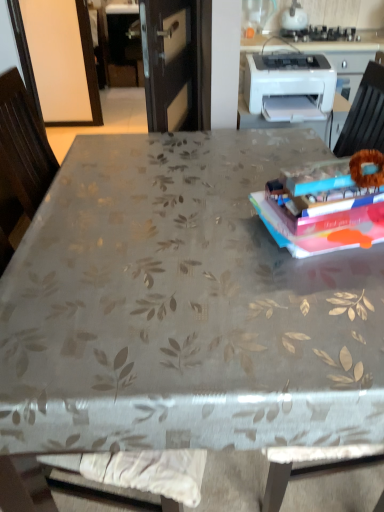
Question: Considering the relative sizes of white plastic printer at upper right and hardcover book at upper right in the image provided, is white plastic printer at upper right bigger than hardcover book at upper right?

Choices:
 (A) no
 (B) yes

Answer: (B)

Question: Is white plastic printer at upper right oriented away from hardcover book at upper right?

Choices:
 (A) yes
 (B) no

Answer: (B)

Question: Is the position of white plastic printer at upper right less distant than that of hardcover book at upper right?

Choices:
 (A) yes
 (B) no

Answer: (B)

Question: Is white plastic printer at upper right at the left side of hardcover book at upper right?

Choices:
 (A) no
 (B) yes

Answer: (A)

Question: Does white plastic printer at upper right have a greater height compared to hardcover book at upper right?

Choices:
 (A) yes
 (B) no

Answer: (A)

Question: Is white glossy kettle at upper center bigger or smaller than white plastic printer at upper right?

Choices:
 (A) small
 (B) big

Answer: (A)

Question: Is point (306, 16) positioned closer to the camera than point (273, 96)?

Choices:
 (A) closer
 (B) farther

Answer: (B)

Question: Is white glossy kettle at upper center inside or outside of white plastic printer at upper right?

Choices:
 (A) inside
 (B) outside

Answer: (B)

Question: From the image's perspective, is white glossy kettle at upper center located above or below white plastic printer at upper right?

Choices:
 (A) below
 (B) above

Answer: (B)

Question: From the image's perspective, is white plastic printer at upper right positioned above or below hardcover book at upper right?

Choices:
 (A) above
 (B) below

Answer: (A)

Question: In terms of size, does white plastic printer at upper right appear bigger or smaller than hardcover book at upper right?

Choices:
 (A) big
 (B) small

Answer: (A)

Question: Is white plastic printer at upper right to the left or to the right of hardcover book at upper right in the image?

Choices:
 (A) left
 (B) right

Answer: (B)

Question: Is white plastic printer at upper right inside or outside of hardcover book at upper right?

Choices:
 (A) inside
 (B) outside

Answer: (B)

Question: Do you think white glossy kettle at upper center is within hardcover book at upper right, or outside of it?

Choices:
 (A) outside
 (B) inside

Answer: (A)

Question: Looking at their shapes, would you say white glossy kettle at upper center is wider or thinner than hardcover book at upper right?

Choices:
 (A) wide
 (B) thin

Answer: (B)